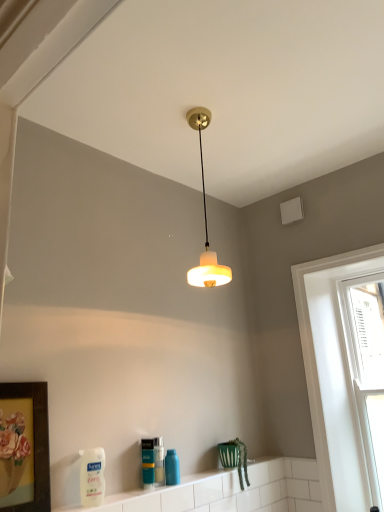
Image resolution: width=384 pixels, height=512 pixels. In order to click on free spot above translucent glass lampshade at upper center (from a real-world perspective) in this screenshot , I will do `click(201, 111)`.